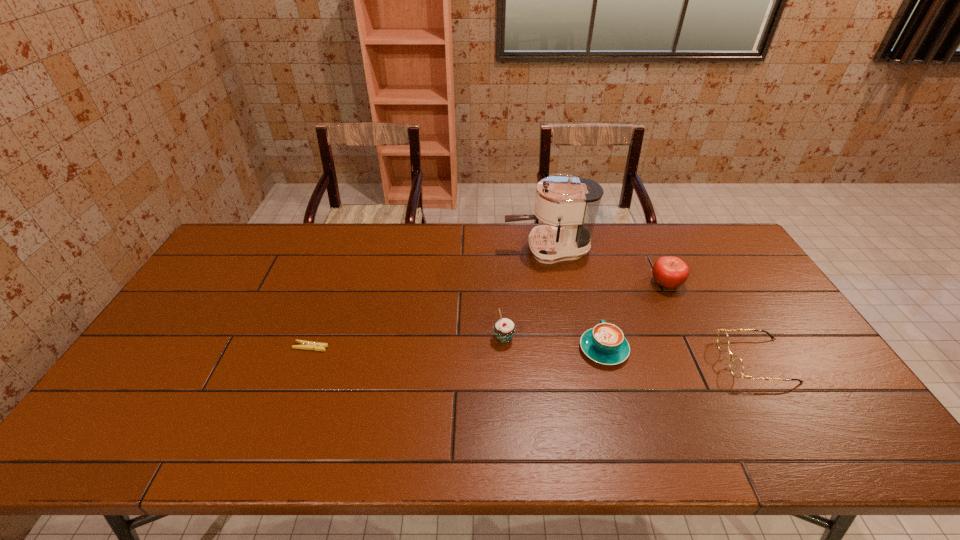
Find the location of a particular element. coffee maker is located at coordinates (571, 202).

Find the location of a particular element. The width and height of the screenshot is (960, 540). the farthest object is located at coordinates (571, 202).

I want to click on apple, so click(670, 272).

Where is `the second farthest object`? This screenshot has width=960, height=540. the second farthest object is located at coordinates (670, 272).

In order to click on cupcake in this screenshot , I will do point(504,329).

Locate an element on the screen. Image resolution: width=960 pixels, height=540 pixels. cappuccino is located at coordinates (605, 343).

Identify the location of spectacles. Image resolution: width=960 pixels, height=540 pixels. (736, 365).

You are a GUI agent. You are given a task and a screenshot of the screen. Output one action in this format:
    pyautogui.click(x=<x>, y=<y>)
    Task: Click on the clothespin
    This screenshot has width=960, height=540.
    Given the screenshot: What is the action you would take?
    pyautogui.click(x=308, y=345)

The height and width of the screenshot is (540, 960). Find the location of `the shortest object`. the shortest object is located at coordinates (308, 345).

The width and height of the screenshot is (960, 540). What are the coordinates of `vacant area located 0.070m on the front-facing side of the coffee maker` in the screenshot? It's located at (484, 249).